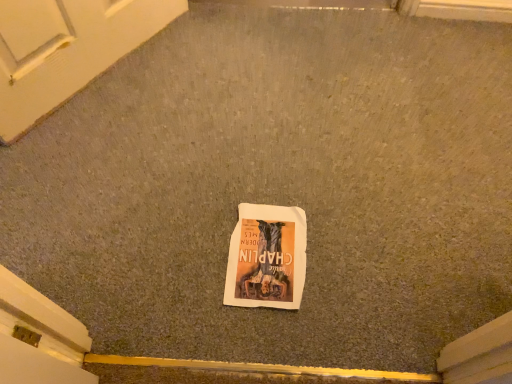
Identify the location of white paper at center. The image size is (512, 384). (267, 257).

The width and height of the screenshot is (512, 384). What do you see at coordinates (267, 257) in the screenshot?
I see `white paper at center` at bounding box center [267, 257].

Image resolution: width=512 pixels, height=384 pixels. In order to click on white paper at center in this screenshot , I will do `click(267, 257)`.